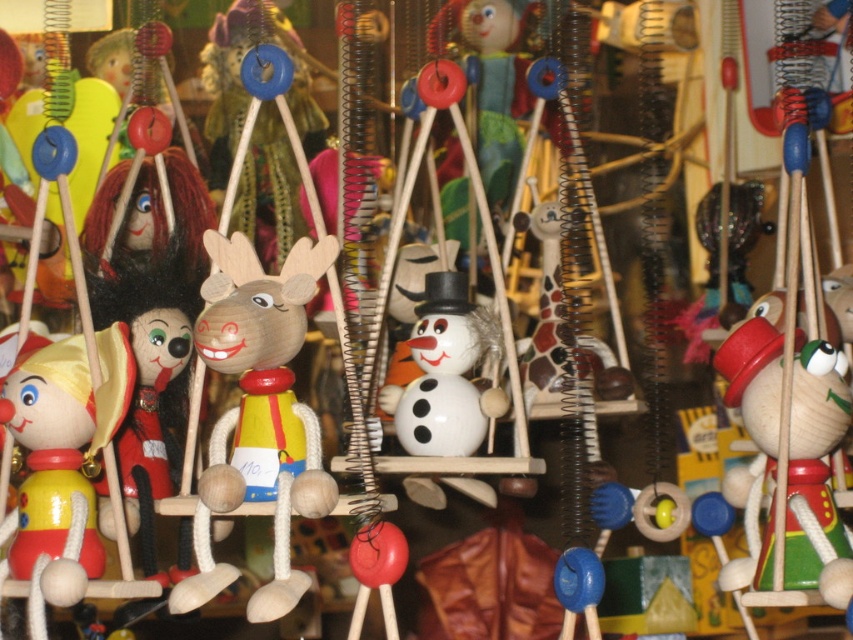
Which is more to the right, wooden reindeer at center or wooden clown at center?

wooden clown at center is more to the right.

The height and width of the screenshot is (640, 853). In order to click on wooden reindeer at center in this screenshot , I will do `click(258, 412)`.

Where is `wooden reindeer at center`? Image resolution: width=853 pixels, height=640 pixels. wooden reindeer at center is located at coordinates (258, 412).

Looking at this image, is wooden reindeer at center taller than matte yellow wood clown at left?

Yes, wooden reindeer at center is taller than matte yellow wood clown at left.

Does wooden reindeer at center have a lesser height compared to matte yellow wood clown at left?

No, wooden reindeer at center is not shorter than matte yellow wood clown at left.

Is point (242, 426) positioned after point (39, 474)?

No, (242, 426) is in front of (39, 474).

Where is `wooden reindeer at center`? wooden reindeer at center is located at coordinates (258, 412).

Measure the distance between point (819, 358) and camera.

They are 1.12 meters apart.

Does wooden clown at center have a greater height compared to matte yellow wood clown at left?

Yes, wooden clown at center is taller than matte yellow wood clown at left.

Is point (770, 552) less distant than point (103, 376)?

Yes, point (770, 552) is in front of point (103, 376).

The height and width of the screenshot is (640, 853). Identify the location of wooden clown at center. (787, 461).